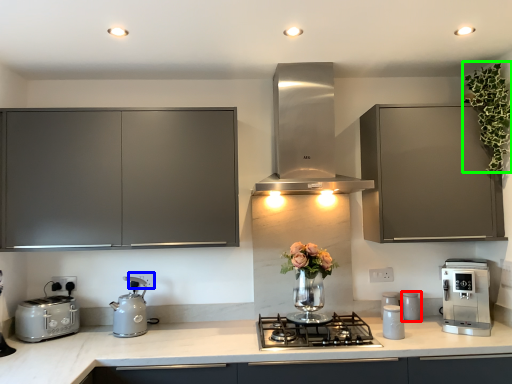
Question: Which object is the closest to the kitchen appliance (highlighted by a red box)? Choose among these: electric outlet (highlighted by a blue box) or floral arrangement (highlighted by a green box).

Choices:
 (A) electric outlet
 (B) floral arrangement

Answer: (B)